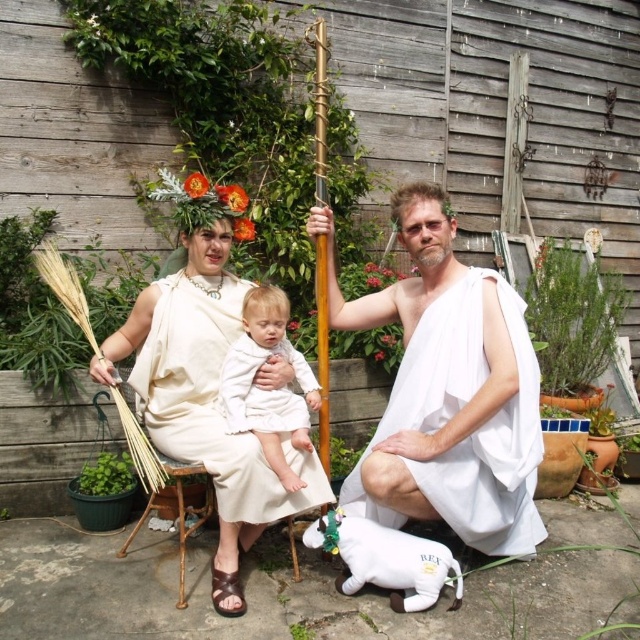
You are an artist trying to sketch this scene. You notice the matte white toga at center and the white soft fabric baby at center. Which one should you draw first if you want to start with the larger object?

The matte white toga at center is bigger than the white soft fabric baby at center, so you should draw the matte white toga at center first.

You are a costume designer preparing for a play and need to know if two toga costumes, the white cloth toga at center and the matte white toga at center, can be hung side by side on a rack that is 1 meter wide. Can they fit without overlapping?

The distance between the white cloth toga at center and the matte white toga at center is 58.68 centimeters. Since the rack is 1 meter wide, which is 100 centimeters, there is enough space to hang both togas side by side without overlapping.